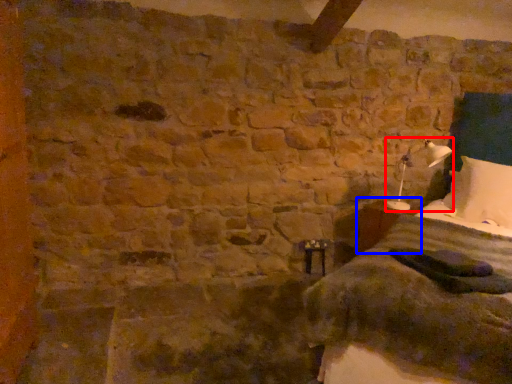
Question: Which of the following is the closest to the observer, bedside lamp (highlighted by a red box) or table (highlighted by a blue box)?

Choices:
 (A) bedside lamp
 (B) table

Answer: (A)